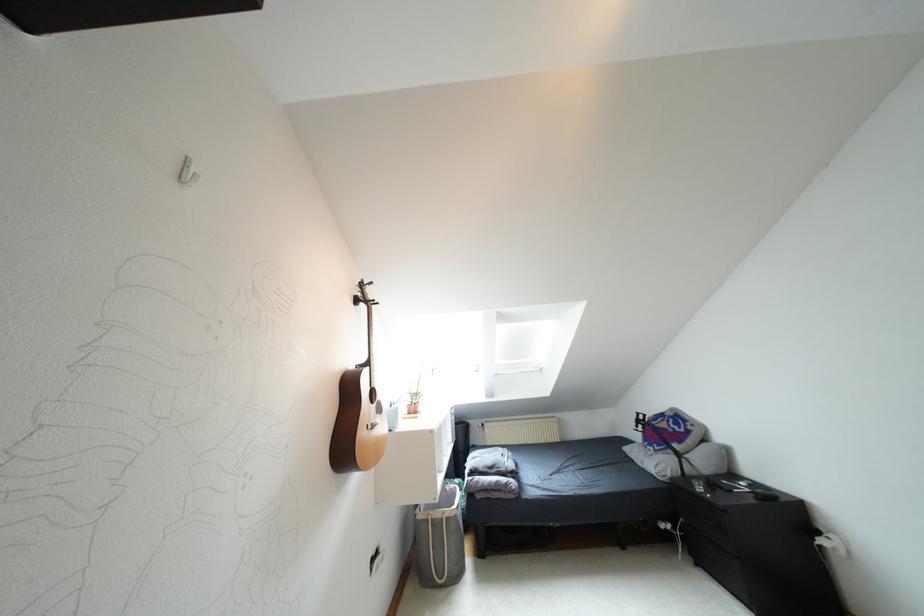
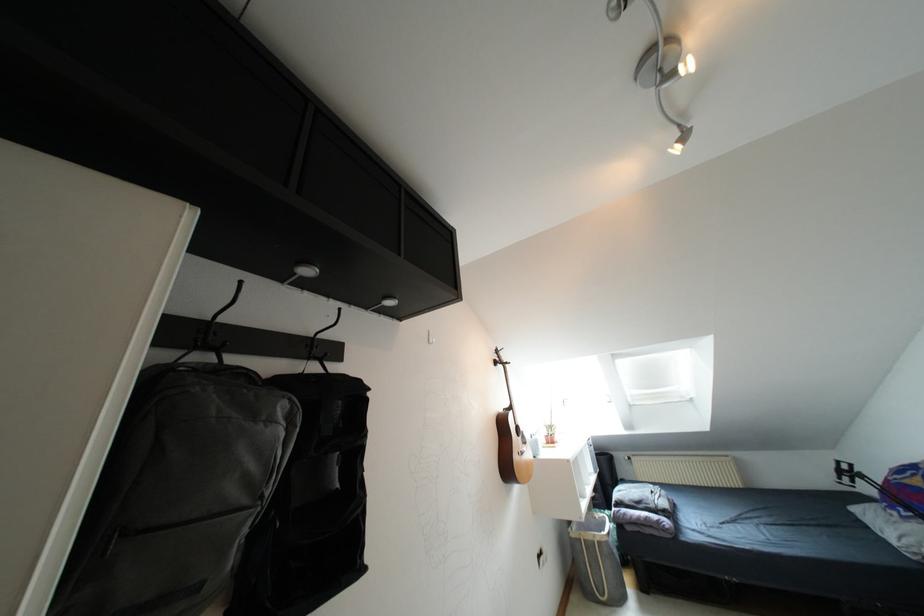
The point at (361, 305) is marked in the first image. Where is the corresponding point in the second image?

(499, 366)